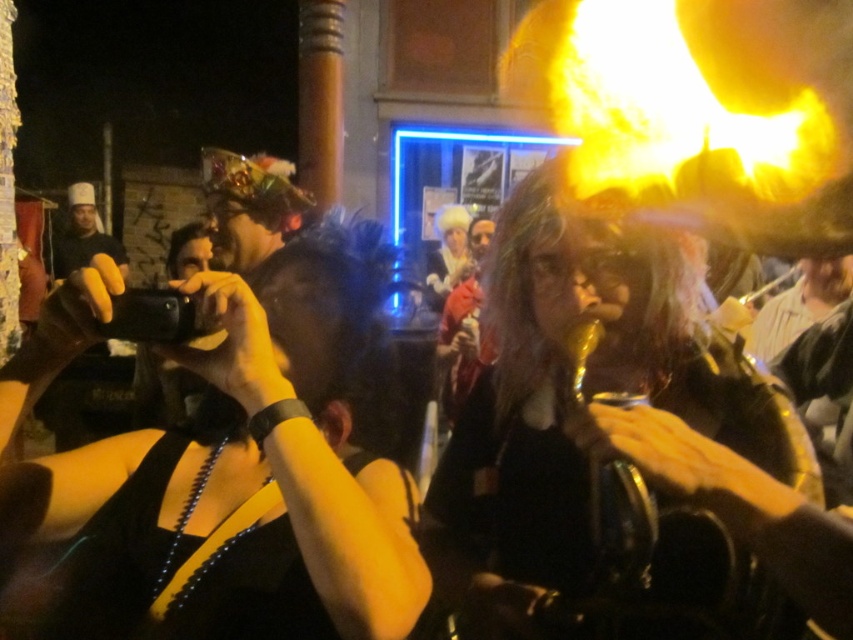
You are a photographer trying to capture the performer with shiny black hair at center using your black matte camera at center. Since the camera is wider than the hair, will you be able to frame the hair entirely in the photo?

The black matte camera at center has a width larger than the shiny black hair at center. This means the camera can accommodate capturing the entire hair in the frame since its width is sufficient to encompass the narrower subject.

You are a photographer trying to capture the performer with shiny black hair at center. You have a black matte camera at center. Since the camera is closer to the viewer, will you be able to focus on the performer?

The black matte camera at center is closer to the viewer than the shiny black hair at center, so focusing on the performer might be challenging as the camera is positioned in front of them.